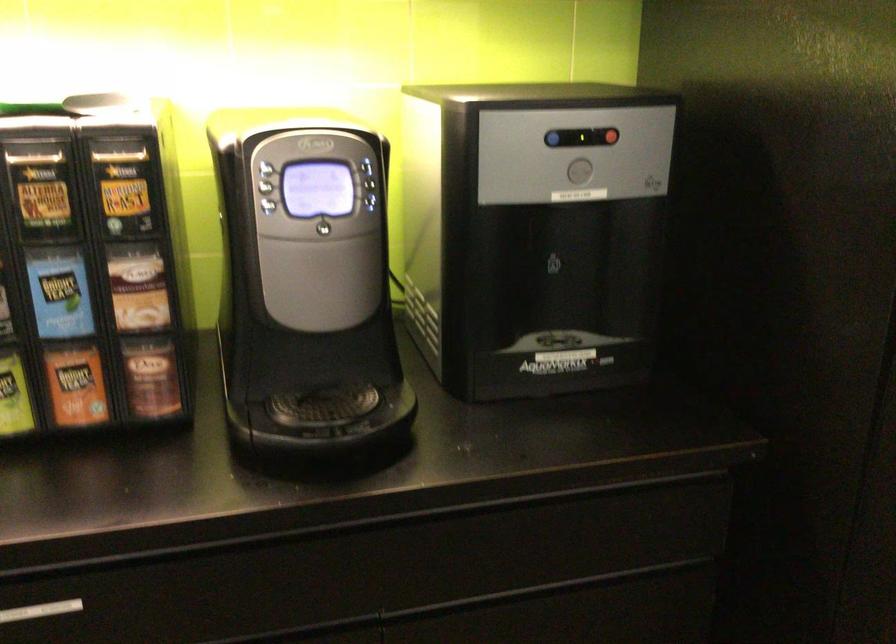
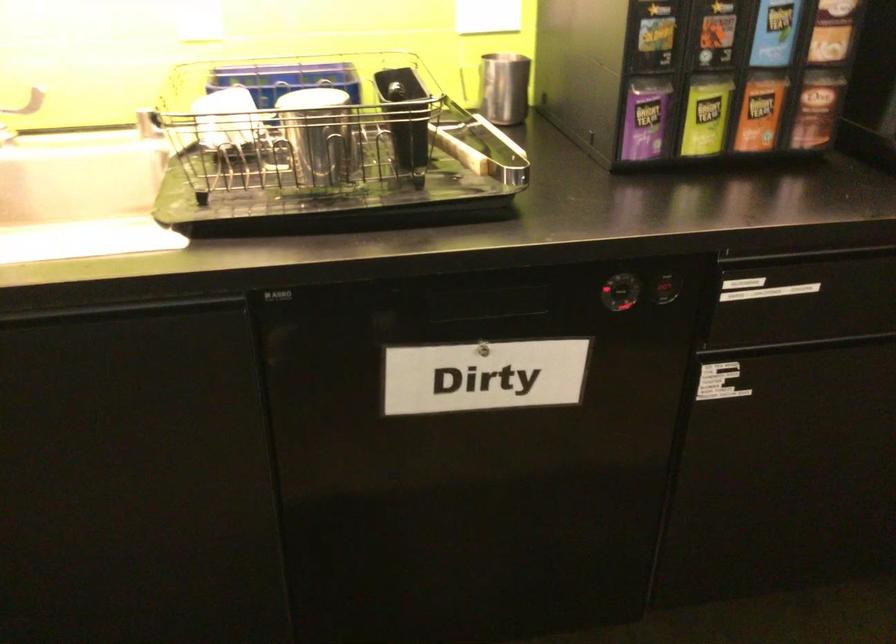
Question: The images are taken continuously from a first-person perspective. In which direction are you moving?

Choices:
 (A) Left
 (B) Right
 (C) Forward
 (D) Backward

Answer: (A)